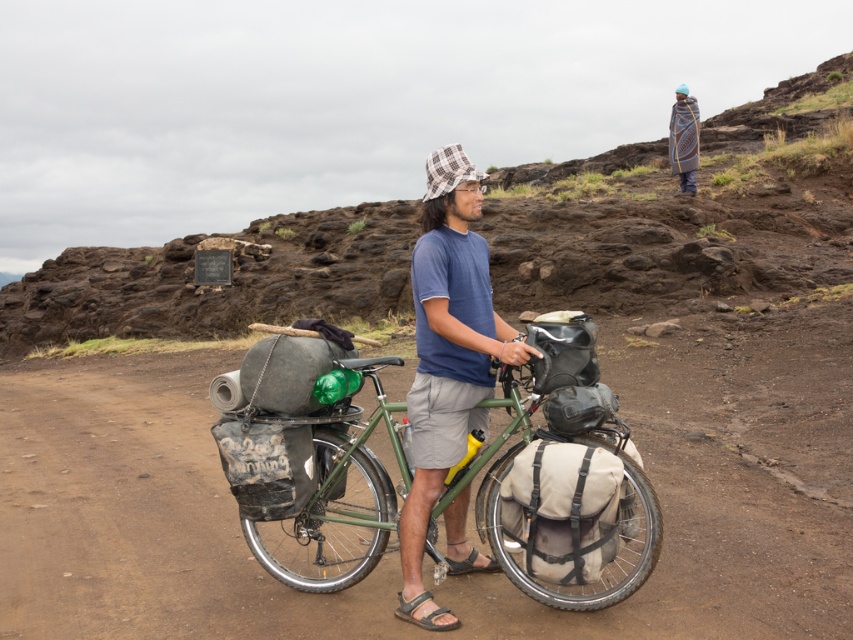
Question: Does brown dirt track at center have a greater width compared to blue cotton shirt at center?

Choices:
 (A) no
 (B) yes

Answer: (B)

Question: Is green matte bicycle at center below blue cotton shirt at center?

Choices:
 (A) no
 (B) yes

Answer: (B)

Question: Considering the real-world distances, which object is farthest from the blue cotton shirt at center?

Choices:
 (A) green matte bicycle at center
 (B) brown leather sandal at lower center
 (C) brown dirt track at center

Answer: (C)

Question: Is green matte bicycle at center bigger than brown leather sandal at lower center?

Choices:
 (A) yes
 (B) no

Answer: (A)

Question: Which point is farther to the camera?

Choices:
 (A) (120, 508)
 (B) (426, 205)

Answer: (A)

Question: Which of these objects is positioned farthest from the brown dirt track at center?

Choices:
 (A) brown leather sandal at lower center
 (B) green matte bicycle at center
 (C) blue cotton shirt at center

Answer: (A)